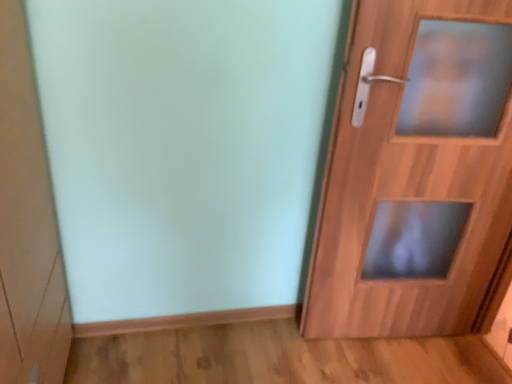
You are a GUI agent. You are given a task and a screenshot of the screen. Output one action in this format:
    pyautogui.click(x=<x>, y=<y>)
    Task: Click on the vacant position to the left of wooden door at right
    This screenshot has width=512, height=384.
    Given the screenshot: What is the action you would take?
    pyautogui.click(x=283, y=351)